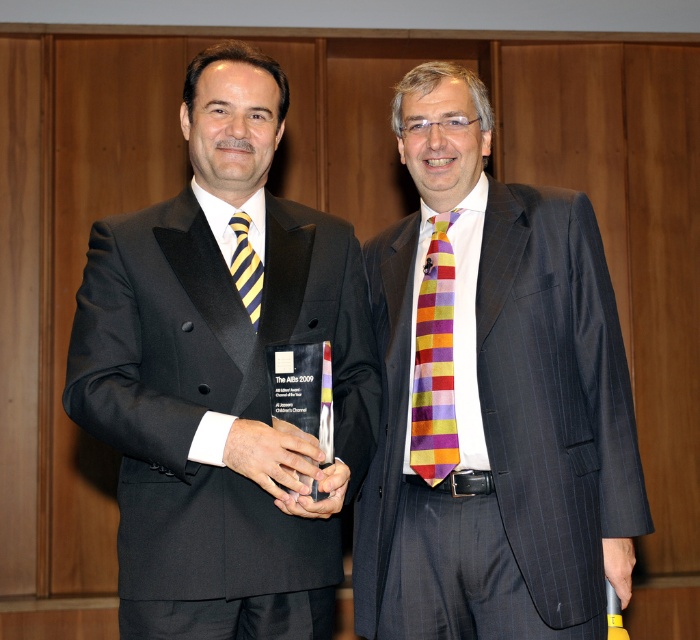
Question: Which point is farther to the camera?

Choices:
 (A) (363, 292)
 (B) (427, 410)

Answer: (A)

Question: Which point is closer to the camera taking this photo?

Choices:
 (A) (216, 291)
 (B) (246, 269)

Answer: (A)

Question: Is multicolored striped tie at center thinner than yellow striped tie at left?

Choices:
 (A) yes
 (B) no

Answer: (B)

Question: Which point is closer to the camera?

Choices:
 (A) multicolored striped tie at center
 (B) matte black suit at center
 (C) yellow striped tie at left
 (D) striped silk tie at center

Answer: (B)

Question: Is matte black suit at center in front of multicolored striped tie at center?

Choices:
 (A) yes
 (B) no

Answer: (A)

Question: Is striped silk tie at center smaller than multicolored striped tie at center?

Choices:
 (A) yes
 (B) no

Answer: (B)